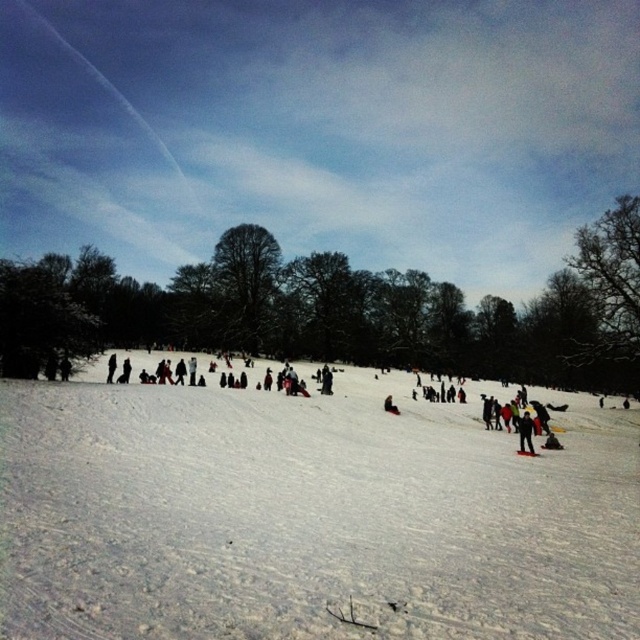
Question: Considering the real-world distances, which object is farthest from the dark red fabric at center?

Choices:
 (A) white plastic ski at center
 (B) white snow at center
 (C) black matte jacket at lower right

Answer: (B)

Question: Does dark red fabric at center appear over white plastic ski at center?

Choices:
 (A) no
 (B) yes

Answer: (B)

Question: Among these points, which one is nearest to the camera?

Choices:
 (A) (394, 410)
 (B) (516, 451)
 (C) (524, 422)

Answer: (B)

Question: Where is black matte jacket at lower right located in relation to white plastic ski at center in the image?

Choices:
 (A) below
 (B) above

Answer: (B)

Question: Can you confirm if black matte jacket at lower right is smaller than dark red fabric at center?

Choices:
 (A) yes
 (B) no

Answer: (B)

Question: Which point is farther to the camera?

Choices:
 (A) black matte jacket at lower right
 (B) white snow at center

Answer: (A)